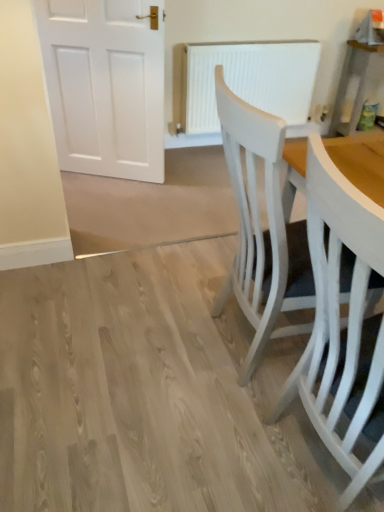
At what (x,y) coordinates should I click in order to perform the action: click on white painted wood chair at right, acting as the 2th chair starting from the back. Please return your answer as a coordinate pair (x, y). Looking at the image, I should click on (339, 312).

The width and height of the screenshot is (384, 512). I want to click on white textured radiator at center, so click(248, 80).

What's the angular difference between white textured radiator at center and white painted wood chair at right, which ranks as the second chair in front-to-back order,'s facing directions?

The facing directions of white textured radiator at center and white painted wood chair at right, which ranks as the second chair in front-to-back order, are 90.6 degrees apart.

How much distance is there between white textured radiator at center and white painted wood chair at right, which ranks as the second chair in front-to-back order?

white textured radiator at center and white painted wood chair at right, which ranks as the second chair in front-to-back order, are 1.89 meters apart from each other.

Locate an element on the screen. Image resolution: width=384 pixels, height=512 pixels. radiator below the white painted wood chair at right, which ranks as the second chair in front-to-back order (from a real-world perspective) is located at coordinates (248, 80).

Is white textured radiator at center completely or partially outside of white painted wood chair at right, which appears as the 1th chair when viewed from the back?

Yes, white textured radiator at center is outside of white painted wood chair at right, which appears as the 1th chair when viewed from the back.

Can white painted wood chair at right, which is the first chair in front-to-back order, be found inside white textured radiator at center?

No, white textured radiator at center does not contain white painted wood chair at right, which is the first chair in front-to-back order.

Which object is thinner, white textured radiator at center or white painted wood chair at right, which is the first chair in front-to-back order?

With smaller width is white textured radiator at center.

Can you confirm if white textured radiator at center is bigger than white painted wood chair at right, which is the first chair in front-to-back order?

No.

From the image's perspective, would you say white textured radiator at center is positioned over white painted wood chair at right, which is the first chair in front-to-back order?

Yes, from the image's perspective, white textured radiator at center is above white painted wood chair at right, which is the first chair in front-to-back order.

Considering the sizes of white painted wood chair at right, which ranks as the second chair in front-to-back order, and white painted wood chair at right, acting as the 2th chair starting from the back, in the image, is white painted wood chair at right, which ranks as the second chair in front-to-back order, wider or thinner than white painted wood chair at right, acting as the 2th chair starting from the back,?

white painted wood chair at right, which ranks as the second chair in front-to-back order, is wider than white painted wood chair at right, acting as the 2th chair starting from the back.

Is white painted wood chair at right, which ranks as the second chair in front-to-back order, not within white painted wood chair at right, which is the first chair in front-to-back order?

Yes, white painted wood chair at right, which ranks as the second chair in front-to-back order, is outside of white painted wood chair at right, which is the first chair in front-to-back order.

From a real-world perspective, who is located higher, white painted wood chair at right, which ranks as the second chair in front-to-back order, or white painted wood chair at right, acting as the 2th chair starting from the back?

In real-world perspective, white painted wood chair at right, which ranks as the second chair in front-to-back order, is above.

Is point (285, 330) positioned before point (275, 73)?

Yes.

Considering the sizes of objects white painted wood chair at right, which appears as the 1th chair when viewed from the back, and white textured radiator at center in the image provided, who is shorter, white painted wood chair at right, which appears as the 1th chair when viewed from the back, or white textured radiator at center?

white textured radiator at center is shorter.

What's the angular difference between white painted wood chair at right, which appears as the 1th chair when viewed from the back, and white textured radiator at center's facing directions?

90.6 degrees separate the facing orientations of white painted wood chair at right, which appears as the 1th chair when viewed from the back, and white textured radiator at center.

Is white painted wood chair at right, which appears as the 1th chair when viewed from the back, inside or outside of white textured radiator at center?

white painted wood chair at right, which appears as the 1th chair when viewed from the back, cannot be found inside white textured radiator at center.

Is white painted wood chair at right, which is the first chair in front-to-back order, to the left or to the right of white textured radiator at center in the image?

Based on their positions, white painted wood chair at right, which is the first chair in front-to-back order, is located to the right of white textured radiator at center.

From a real-world perspective, is white painted wood chair at right, which is the first chair in front-to-back order, positioned above or below white textured radiator at center?

From a real-world perspective, white painted wood chair at right, which is the first chair in front-to-back order, is physically above white textured radiator at center.

From the picture: What's the angular difference between white painted wood chair at right, which is the first chair in front-to-back order, and white textured radiator at center's facing directions?

white painted wood chair at right, which is the first chair in front-to-back order, and white textured radiator at center are facing 90.6 degrees away from each other.

Is white painted wood chair at right, which is the first chair in front-to-back order, smaller than white textured radiator at center?

No.

From the picture: Who is smaller, white painted wood chair at right, acting as the 2th chair starting from the back, or white painted wood chair at right, which appears as the 1th chair when viewed from the back?

white painted wood chair at right, acting as the 2th chair starting from the back, is smaller.

Is white painted wood chair at right, which is the first chair in front-to-back order, looking in the opposite direction of white painted wood chair at right, which appears as the 1th chair when viewed from the back?

That's not correct — white painted wood chair at right, which is the first chair in front-to-back order, is not looking away from white painted wood chair at right, which appears as the 1th chair when viewed from the back.

Who is taller, white painted wood chair at right, acting as the 2th chair starting from the back, or white painted wood chair at right, which ranks as the second chair in front-to-back order?

white painted wood chair at right, which ranks as the second chair in front-to-back order.

Locate an element on the screen. the 2nd chair directly above the white textured radiator at center (from a real-world perspective) is located at coordinates (260, 228).

Where is `radiator behind the white painted wood chair at right, which is the first chair in front-to-back order`? This screenshot has width=384, height=512. radiator behind the white painted wood chair at right, which is the first chair in front-to-back order is located at coordinates (248, 80).

When comparing their distances from white textured radiator at center, does white painted wood chair at right, which is the first chair in front-to-back order, or white painted wood chair at right, which appears as the 1th chair when viewed from the back, seem further?

Among the two, white painted wood chair at right, which is the first chair in front-to-back order, is located further to white textured radiator at center.

Looking at the image, which one is located further to white painted wood chair at right, which ranks as the second chair in front-to-back order, white painted wood chair at right, which is the first chair in front-to-back order, or white textured radiator at center?

The object further to white painted wood chair at right, which ranks as the second chair in front-to-back order, is white textured radiator at center.

From the image, which object appears to be nearer to white painted wood chair at right, acting as the 2th chair starting from the back, white painted wood chair at right, which appears as the 1th chair when viewed from the back, or white textured radiator at center?

white painted wood chair at right, which appears as the 1th chair when viewed from the back.

Considering their positions, is white textured radiator at center positioned further to white painted wood chair at right, acting as the 2th chair starting from the back, than white painted wood chair at right, which appears as the 1th chair when viewed from the back?

The object further to white painted wood chair at right, acting as the 2th chair starting from the back, is white textured radiator at center.

Consider the image. Considering their positions, is white painted wood chair at right, which appears as the 1th chair when viewed from the back, positioned closer to white textured radiator at center than white painted wood chair at right, acting as the 2th chair starting from the back?

Based on the image, white painted wood chair at right, which appears as the 1th chair when viewed from the back, appears to be nearer to white textured radiator at center.

From the image, which object appears to be nearer to white painted wood chair at right, which ranks as the second chair in front-to-back order, white textured radiator at center or white painted wood chair at right, which is the first chair in front-to-back order?

The object closer to white painted wood chair at right, which ranks as the second chair in front-to-back order, is white painted wood chair at right, which is the first chair in front-to-back order.

Locate an element on the screen. The height and width of the screenshot is (512, 384). chair between white painted wood chair at right, acting as the 2th chair starting from the back, and white textured radiator at center in the front-back direction is located at coordinates (260, 228).